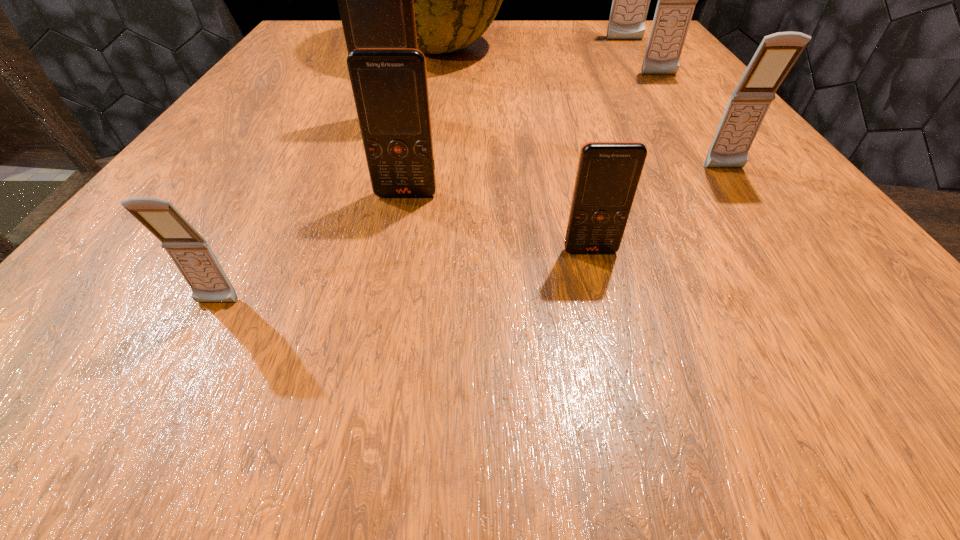
Point out which object is positioned as the fifth nearest to the third nearest object. Please provide its 2D coordinates. Your answer should be formatted as a tuple, i.e. [(x, y)], where the tuple contains the x and y coordinates of a point satisfying the conditions above.

[(777, 53)]

This screenshot has width=960, height=540. What are the coordinates of `object that stands as the fourth closest to the fifth farthest cellular telephone` in the screenshot? It's located at (455, 0).

Locate which cellular telephone ranks in proximity to the tallest object. Please provide its 2D coordinates. Your answer should be formatted as a tuple, i.e. [(x, y)], where the tuple contains the x and y coordinates of a point satisfying the conditions above.

[(375, 0)]

In order to click on the second closest cellular telephone relative to the second nearest orange cellular telephone in this screenshot , I will do `click(375, 0)`.

You are a GUI agent. You are given a task and a screenshot of the screen. Output one action in this format:
    pyautogui.click(x=<x>, y=<y>)
    Task: Click on the gray cellular telephone that stands as the second closest to the farthest orange cellular telephone
    
    Given the screenshot: What is the action you would take?
    coord(777,53)

Locate an element on the screen. The image size is (960, 540). gray cellular telephone object that ranks as the closest to the second nearest gray cellular telephone is located at coordinates (676, 0).

Locate which orange cellular telephone is the closest to the tallest cellular telephone. Please provide its 2D coordinates. Your answer should be formatted as a tuple, i.e. [(x, y)], where the tuple contains the x and y coordinates of a point satisfying the conditions above.

[(375, 0)]

Locate an element on the screen. The image size is (960, 540). orange cellular telephone identified as the second closest to the farthest gray cellular telephone is located at coordinates (390, 87).